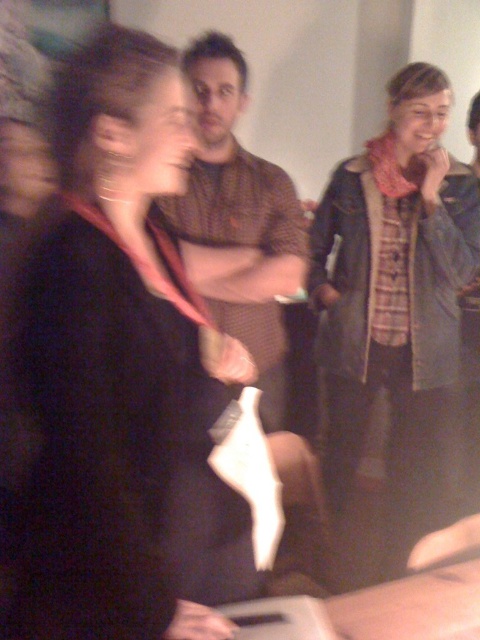
Looking at this image, does plaid fabric scarf at upper right appear over brown textured shirt at center?

Actually, plaid fabric scarf at upper right is below brown textured shirt at center.

Is plaid fabric scarf at upper right further to camera compared to brown textured shirt at center?

Yes, it is behind brown textured shirt at center.

I want to click on plaid fabric scarf at upper right, so click(394, 324).

How distant is matte black scarf at center from plaid fabric scarf at upper right?

matte black scarf at center and plaid fabric scarf at upper right are 1.07 meters apart.

This screenshot has height=640, width=480. Describe the element at coordinates (130, 381) in the screenshot. I see `matte black scarf at center` at that location.

Locate an element on the screen. matte black scarf at center is located at coordinates (130, 381).

Which is more to the left, matte black scarf at center or brown textured shirt at center?

Positioned to the left is matte black scarf at center.

Can you confirm if matte black scarf at center is thinner than brown textured shirt at center?

In fact, matte black scarf at center might be wider than brown textured shirt at center.

In order to click on matte black scarf at center in this screenshot , I will do `click(130, 381)`.